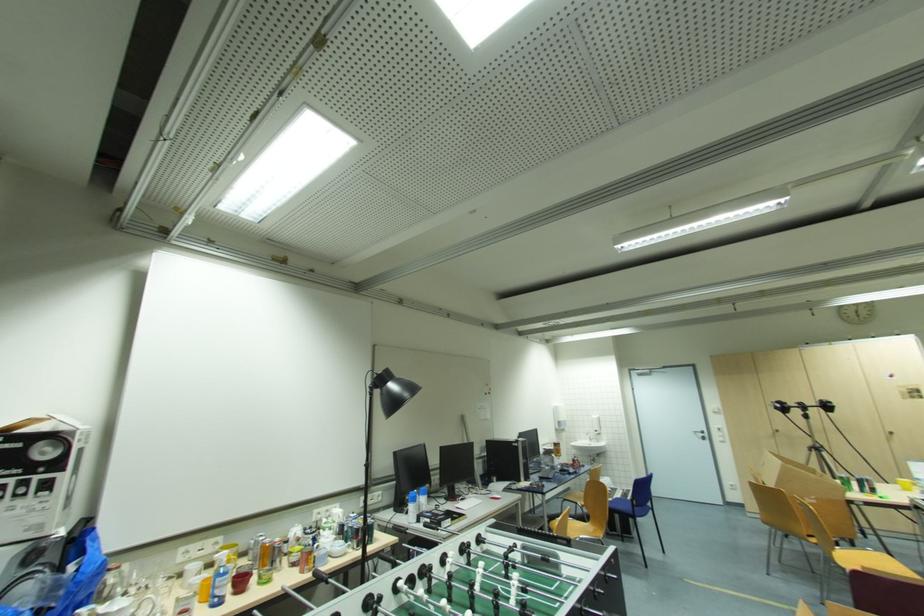
Where is `blue spray bottle`? This screenshot has height=616, width=924. blue spray bottle is located at coordinates (219, 583).